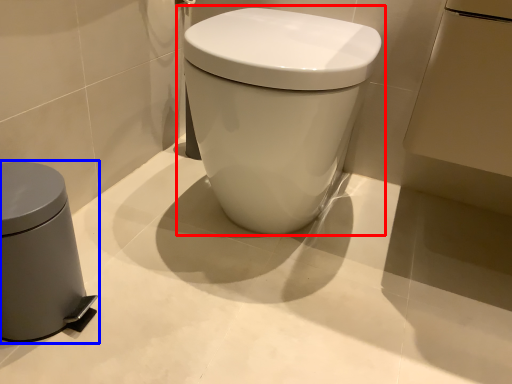
Question: Which point is further to the camera, toilet (highlighted by a red box) or waste container (highlighted by a blue box)?

Choices:
 (A) toilet
 (B) waste container

Answer: (A)